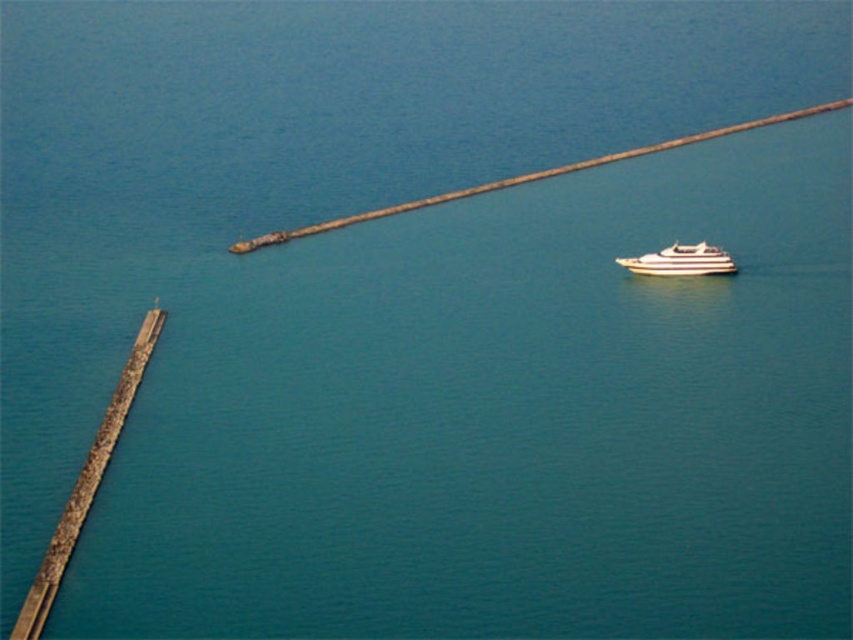
Question: Which object is closer to the camera taking this photo?

Choices:
 (A) gray concrete pier at left
 (B) white striped boat at right

Answer: (A)

Question: Which point is farther to the camera?

Choices:
 (A) (38, 608)
 (B) (699, 246)

Answer: (B)

Question: Can you confirm if gray concrete pier at left is bigger than white striped boat at right?

Choices:
 (A) no
 (B) yes

Answer: (B)

Question: Which point is closer to the camera?

Choices:
 (A) (99, 481)
 (B) (722, 264)

Answer: (A)

Question: Is gray concrete pier at left smaller than white striped boat at right?

Choices:
 (A) yes
 (B) no

Answer: (B)

Question: Where is gray concrete pier at left located in relation to white striped boat at right in the image?

Choices:
 (A) below
 (B) above

Answer: (A)